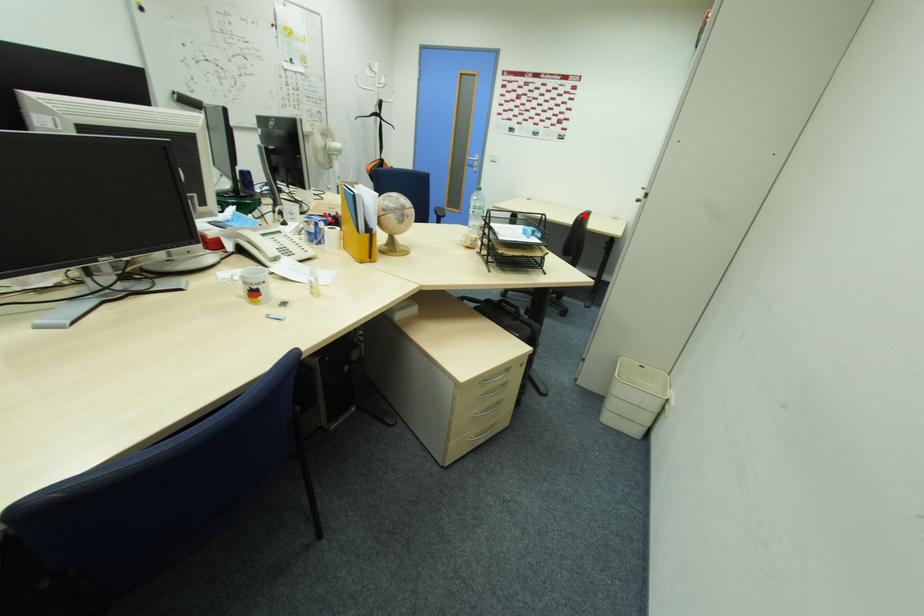
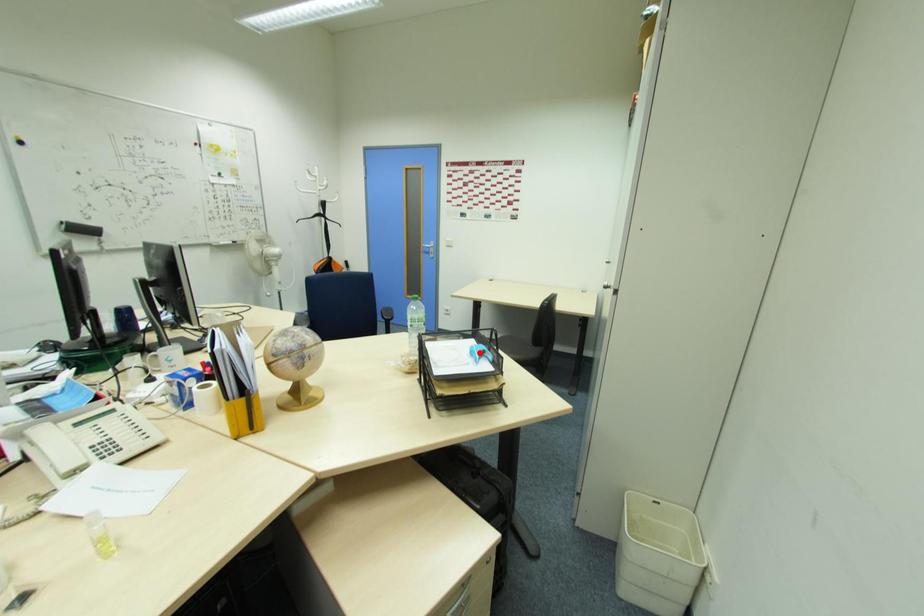
I am providing you with two images of the same scene from different viewpoints. A red point is marked on the first image and another point is marked on the second image. Is the marked point in image1 the same physical position as the marked point in image2?

No